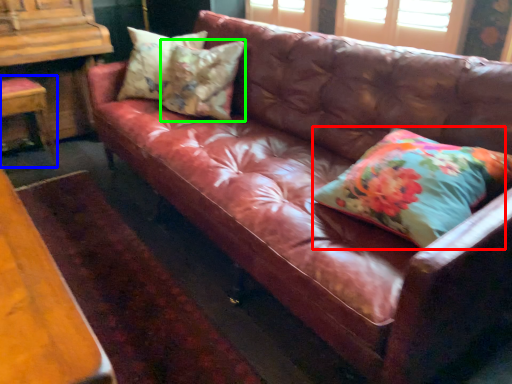
Question: Which object is the farthest from pillow (highlighted by a red box)? Choose among these: chair (highlighted by a blue box) or pillow (highlighted by a green box).

Choices:
 (A) chair
 (B) pillow

Answer: (A)